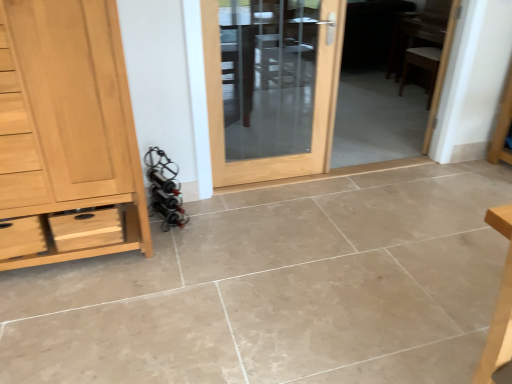
The image size is (512, 384). In order to click on brown wooden chair at right, which is the second chair from top to bottom in this screenshot , I will do 422,66.

Image resolution: width=512 pixels, height=384 pixels. Describe the element at coordinates (422, 66) in the screenshot. I see `wooden chair at right, which is the first chair in top-to-bottom order` at that location.

Find the location of a particular element. The width and height of the screenshot is (512, 384). light brown wood chest of drawers at left is located at coordinates (66, 132).

Locate an element on the screen. brown wooden chair at right, which is the second chair from top to bottom is located at coordinates (422, 66).

Is light brown wood chest of drawers at left facing away from brown wooden chair at right, which is the second chair from top to bottom?

No, light brown wood chest of drawers at left is not facing the opposite direction of brown wooden chair at right, which is the second chair from top to bottom.

Between light brown wood chest of drawers at left and brown wooden chair at right, which is the second chair from top to bottom, which one has smaller size?

brown wooden chair at right, which is the second chair from top to bottom, is smaller.

In the scene shown: Considering the positions of objects light brown wood chest of drawers at left and brown wooden chair at right, placed as the first chair when sorted from bottom to top, in the image provided, who is behind, light brown wood chest of drawers at left or brown wooden chair at right, placed as the first chair when sorted from bottom to top,?

Positioned behind is brown wooden chair at right, placed as the first chair when sorted from bottom to top.

Is wooden chair at right, acting as the 2th chair starting from the bottom, inside light brown wood chest of drawers at left?

No, light brown wood chest of drawers at left does not contain wooden chair at right, acting as the 2th chair starting from the bottom.

The image size is (512, 384). Find the location of `chest of drawers below the wooden chair at right, acting as the 2th chair starting from the bottom (from the image's perspective)`. chest of drawers below the wooden chair at right, acting as the 2th chair starting from the bottom (from the image's perspective) is located at coordinates (66, 132).

Is point (104, 144) in front of point (437, 54)?

Yes, point (104, 144) is in front of point (437, 54).

Can you confirm if light brown wood chest of drawers at left is shorter than matte wooden door at center?

Incorrect, the height of light brown wood chest of drawers at left does not fall short of that of matte wooden door at center.

From the image's perspective, which is above, light brown wood chest of drawers at left or matte wooden door at center?

matte wooden door at center, from the image's perspective.

From a real-world perspective, which is physically above, light brown wood chest of drawers at left or matte wooden door at center?

In real-world perspective, light brown wood chest of drawers at left is above.

Is light brown wood chest of drawers at left looking in the opposite direction of matte wooden door at center?

That's not correct — light brown wood chest of drawers at left is not looking away from matte wooden door at center.

Which of these two, wooden chair at right, acting as the 2th chair starting from the bottom, or matte wooden door at center, stands shorter?

Standing shorter between the two is wooden chair at right, acting as the 2th chair starting from the bottom.

Are wooden chair at right, which is the first chair in top-to-bottom order, and matte wooden door at center located far from each other?

Absolutely, wooden chair at right, which is the first chair in top-to-bottom order, is distant from matte wooden door at center.

From a real-world perspective, is wooden chair at right, which is the first chair in top-to-bottom order, positioned over matte wooden door at center based on gravity?

No, from a real-world perspective, wooden chair at right, which is the first chair in top-to-bottom order, is not above matte wooden door at center.

Is matte wooden door at center at the back of wooden chair at right, acting as the 2th chair starting from the bottom?

No, matte wooden door at center is not at the back of wooden chair at right, acting as the 2th chair starting from the bottom.

Which of these two, matte wooden door at center or brown wooden chair at right, which is the second chair from top to bottom, is wider?

With larger width is brown wooden chair at right, which is the second chair from top to bottom.

Is point (338, 51) closer or farther from the camera than point (440, 53)?

Point (338, 51).

Does matte wooden door at center lie in front of brown wooden chair at right, placed as the first chair when sorted from bottom to top?

That is True.

Are matte wooden door at center and brown wooden chair at right, which is the second chair from top to bottom, making contact?

No, matte wooden door at center is not making contact with brown wooden chair at right, which is the second chair from top to bottom.

Considering their positions, is matte wooden door at center located in front of or behind wooden chair at right, which is the first chair in top-to-bottom order?

In the image, matte wooden door at center appears in front of wooden chair at right, which is the first chair in top-to-bottom order.

In the image, is matte wooden door at center on the left side or the right side of wooden chair at right, acting as the 2th chair starting from the bottom?

matte wooden door at center is positioned on wooden chair at right, acting as the 2th chair starting from the bottom,'s left side.

This screenshot has height=384, width=512. Find the location of `door lying below the wooden chair at right, which is the first chair in top-to-bottom order (from the image's perspective)`. door lying below the wooden chair at right, which is the first chair in top-to-bottom order (from the image's perspective) is located at coordinates (314, 108).

From a real-world perspective, who is located lower, matte wooden door at center or wooden chair at right, which is the first chair in top-to-bottom order?

From a 3D spatial view, wooden chair at right, which is the first chair in top-to-bottom order, is below.

Can light brown wood chest of drawers at left be found inside matte wooden door at center?

No, light brown wood chest of drawers at left is not inside matte wooden door at center.

How far apart are matte wooden door at center and light brown wood chest of drawers at left?

They are 36.59 inches apart.

Would you say matte wooden door at center is a long distance from light brown wood chest of drawers at left?

No, matte wooden door at center is not far from light brown wood chest of drawers at left.

Find the location of a particular element. The width and height of the screenshot is (512, 384). chest of drawers lying on the left of brown wooden chair at right, which is the second chair from top to bottom is located at coordinates (66, 132).

At what (x,y) coordinates should I click in order to perform the action: click on chest of drawers in front of the wooden chair at right, acting as the 2th chair starting from the bottom. Please return your answer as a coordinate pair (x, y). This screenshot has height=384, width=512. Looking at the image, I should click on (66, 132).

Consider the image. Estimate the real-world distances between objects in this image. Which object is closer to matte wooden door at center, light brown wood chest of drawers at left or brown wooden chair at right, which is the second chair from top to bottom?

Among the two, light brown wood chest of drawers at left is located nearer to matte wooden door at center.

When comparing their distances from brown wooden chair at right, which is the second chair from top to bottom, does matte wooden door at center or light brown wood chest of drawers at left seem closer?

The object closer to brown wooden chair at right, which is the second chair from top to bottom, is matte wooden door at center.

From the image, which object appears to be farther from wooden chair at right, which is the first chair in top-to-bottom order, matte wooden door at center or brown wooden chair at right, placed as the first chair when sorted from bottom to top?

matte wooden door at center is positioned further to the anchor wooden chair at right, which is the first chair in top-to-bottom order.

Which object lies nearer to the anchor point brown wooden chair at right, placed as the first chair when sorted from bottom to top, wooden chair at right, acting as the 2th chair starting from the bottom, or light brown wood chest of drawers at left?

Among the two, wooden chair at right, acting as the 2th chair starting from the bottom, is located nearer to brown wooden chair at right, placed as the first chair when sorted from bottom to top.

Which object lies further to the anchor point light brown wood chest of drawers at left, matte wooden door at center or wooden chair at right, which is the first chair in top-to-bottom order?

wooden chair at right, which is the first chair in top-to-bottom order, is further to light brown wood chest of drawers at left.

Considering their positions, is wooden chair at right, which is the first chair in top-to-bottom order, positioned further to light brown wood chest of drawers at left than matte wooden door at center?

Among the two, wooden chair at right, which is the first chair in top-to-bottom order, is located further to light brown wood chest of drawers at left.

Estimate the real-world distances between objects in this image. Which object is further from brown wooden chair at right, placed as the first chair when sorted from bottom to top, matte wooden door at center or wooden chair at right, acting as the 2th chair starting from the bottom?

Among the two, matte wooden door at center is located further to brown wooden chair at right, placed as the first chair when sorted from bottom to top.

Consider the image. Considering their positions, is wooden chair at right, acting as the 2th chair starting from the bottom, positioned closer to matte wooden door at center than brown wooden chair at right, which is the second chair from top to bottom?

Among the two, wooden chair at right, acting as the 2th chair starting from the bottom, is located nearer to matte wooden door at center.

Where is `chair between matte wooden door at center and wooden chair at right, which is the first chair in top-to-bottom order, from left to right`? Image resolution: width=512 pixels, height=384 pixels. chair between matte wooden door at center and wooden chair at right, which is the first chair in top-to-bottom order, from left to right is located at coordinates (422, 66).

Locate an element on the screen. chair between light brown wood chest of drawers at left and wooden chair at right, which is the first chair in top-to-bottom order is located at coordinates (422, 66).

Identify the location of door between light brown wood chest of drawers at left and brown wooden chair at right, which is the second chair from top to bottom, in the horizontal direction. Image resolution: width=512 pixels, height=384 pixels. (314, 108).

Locate an element on the screen. door located between light brown wood chest of drawers at left and wooden chair at right, which is the first chair in top-to-bottom order, in the left-right direction is located at coordinates (314, 108).